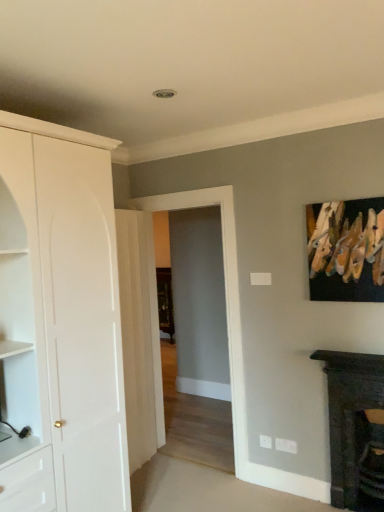
Question: From the image's perspective, relative to white matte cabinet at left, is wooden clothespins at upper right above or below?

Choices:
 (A) below
 (B) above

Answer: (B)

Question: Considering the positions of wooden clothespins at upper right and white matte cabinet at left in the image, is wooden clothespins at upper right taller or shorter than white matte cabinet at left?

Choices:
 (A) tall
 (B) short

Answer: (B)

Question: Which of these objects is positioned farthest from the wooden clothespins at upper right?

Choices:
 (A) transparent glass door at center
 (B) dark wood fireplace at lower right
 (C) white glossy door at center
 (D) white matte cabinet at left

Answer: (C)

Question: Estimate the real-world distances between objects in this image. Which object is closer to the white matte cabinet at left?

Choices:
 (A) wooden clothespins at upper right
 (B) white glossy door at center
 (C) dark wood fireplace at lower right
 (D) transparent glass door at center

Answer: (B)